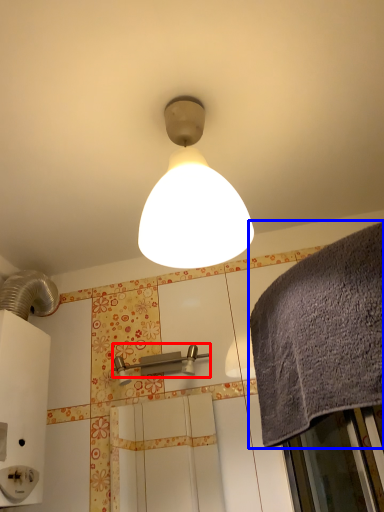
Question: Among these objects, which one is nearest to the camera, shower (highlighted by a red box) or bath towel (highlighted by a blue box)?

Choices:
 (A) shower
 (B) bath towel

Answer: (B)